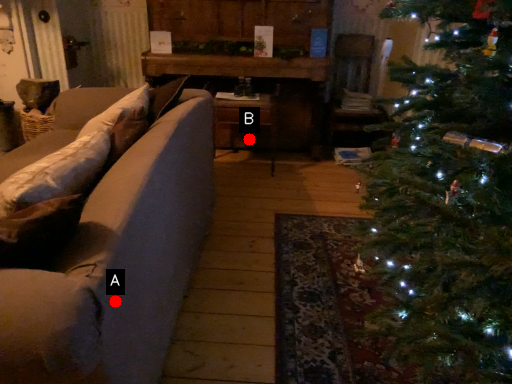
Question: Two points are circled on the image, labeled by A and B beside each circle. Which of the following is the farthest from the observer?

Choices:
 (A) A is further
 (B) B is further

Answer: (B)